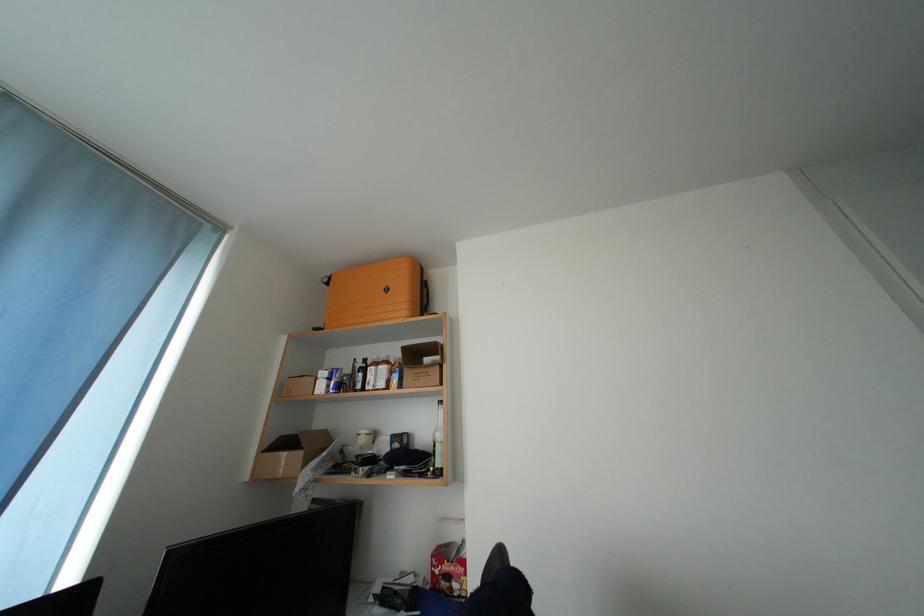
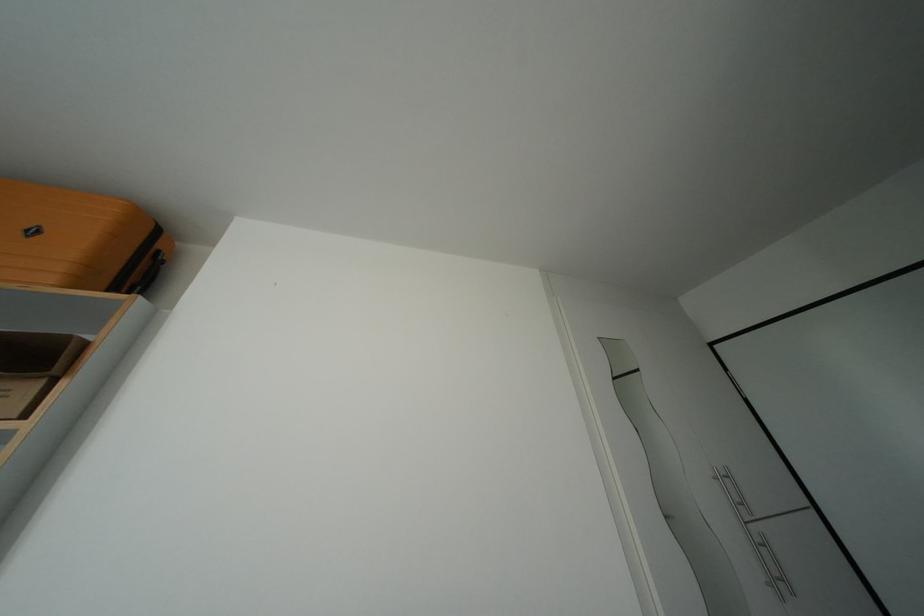
Locate, in the second image, the point that corresponds to (395,294) in the first image.

(42, 237)